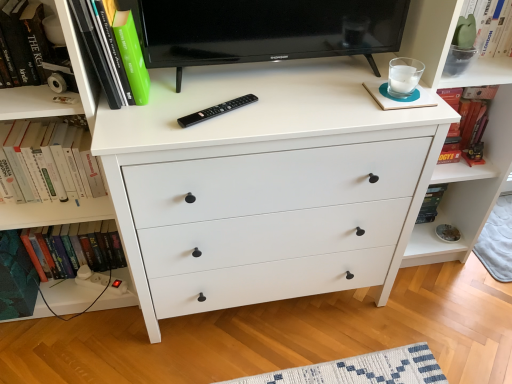
I want to click on vacant space that is in between green matte book at upper left, the first book from the top, and black glossy tv at upper center, so (234, 89).